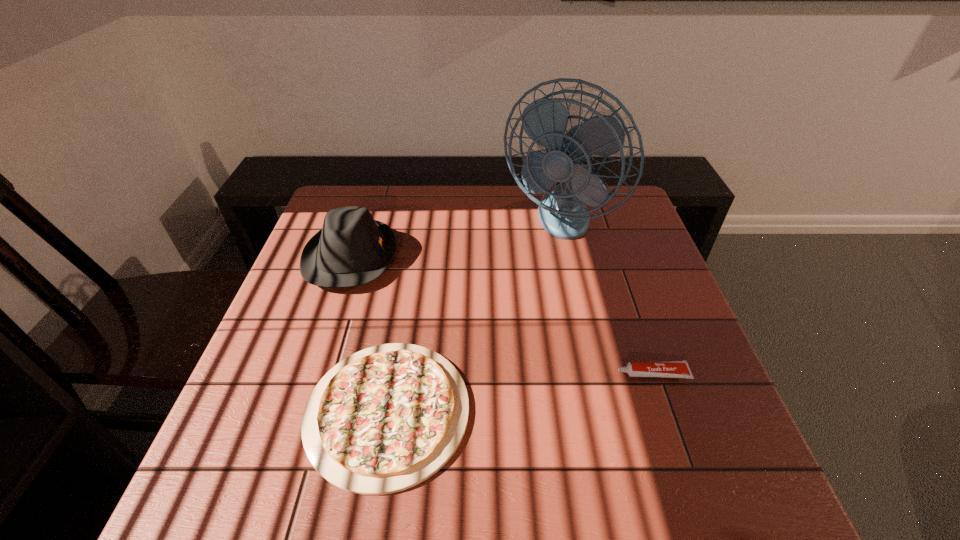
The height and width of the screenshot is (540, 960). Identify the location of vacant space at the far edge. (455, 192).

Image resolution: width=960 pixels, height=540 pixels. Find the location of `blank space at the near edge of the desktop`. blank space at the near edge of the desktop is located at coordinates (290, 502).

This screenshot has width=960, height=540. In the image, there is a desktop. Identify the location of free region at the left edge. (294, 324).

Where is `vacant space at the right edge of the desktop`? This screenshot has height=540, width=960. vacant space at the right edge of the desktop is located at coordinates (658, 362).

Where is `free space at the near left corner of the desktop`? Image resolution: width=960 pixels, height=540 pixels. free space at the near left corner of the desktop is located at coordinates (239, 484).

Where is `empty space between the second tallest object and the pizza`? The width and height of the screenshot is (960, 540). empty space between the second tallest object and the pizza is located at coordinates (370, 334).

The height and width of the screenshot is (540, 960). I want to click on empty location between the toothpaste and the pizza, so click(520, 392).

At what (x,y) coordinates should I click in order to perform the action: click on vacant point located between the fan and the pizza. Please return your answer as a coordinate pair (x, y). This screenshot has height=540, width=960. Looking at the image, I should click on (471, 318).

Where is `vacant area that lies between the toothpaste and the second tallest object`? This screenshot has height=540, width=960. vacant area that lies between the toothpaste and the second tallest object is located at coordinates (502, 315).

The height and width of the screenshot is (540, 960). Identify the location of empty location between the toothpaste and the fedora. (502, 315).